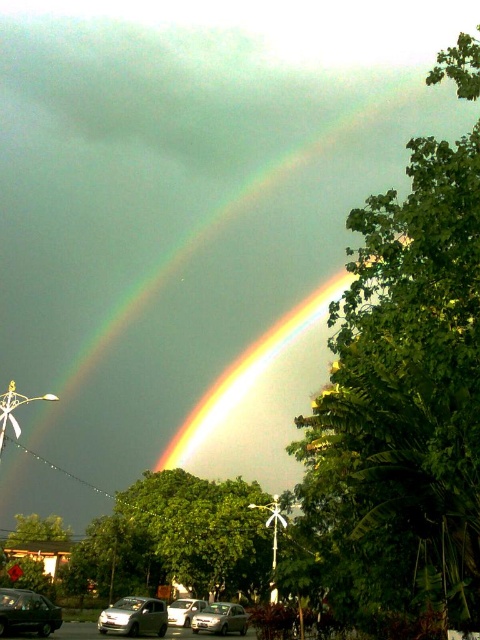
Question: Among these points, which one is farthest from the camera?

Choices:
 (A) (452, 154)
 (B) (64, 346)

Answer: (B)

Question: Which point is farther from the camera taking this photo?

Choices:
 (A) (21, 625)
 (B) (101, 630)

Answer: (B)

Question: Can you confirm if rainbow at upper center is wider than satin silver car at lower center?

Choices:
 (A) yes
 (B) no

Answer: (A)

Question: Can you confirm if metallic green car at lower left is smaller than satin silver car at lower center?

Choices:
 (A) no
 (B) yes

Answer: (A)

Question: Can you confirm if green leafy tree at right is wider than silver metallic car at lower left?

Choices:
 (A) no
 (B) yes

Answer: (B)

Question: Which point is closer to the camera?

Choices:
 (A) (110, 188)
 (B) (425, 531)

Answer: (B)